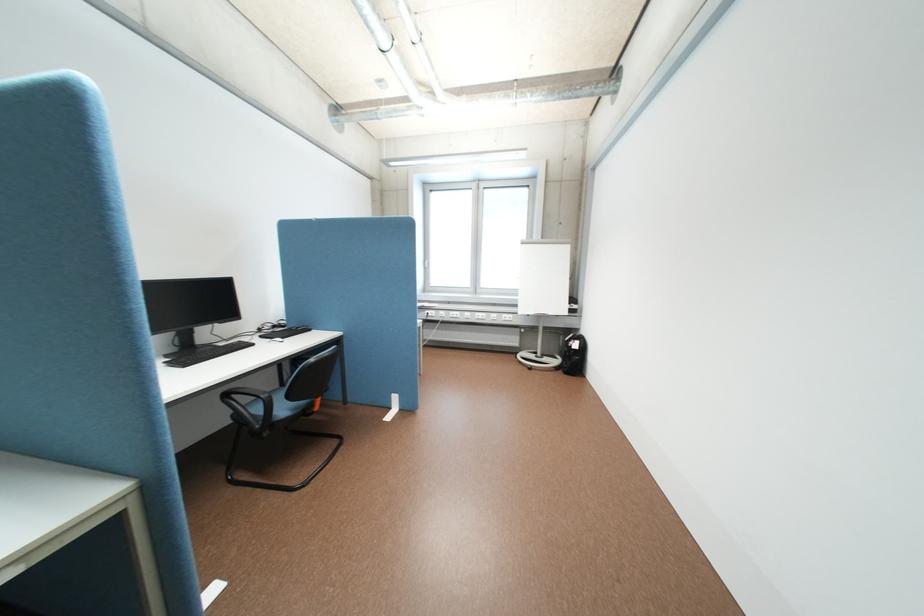
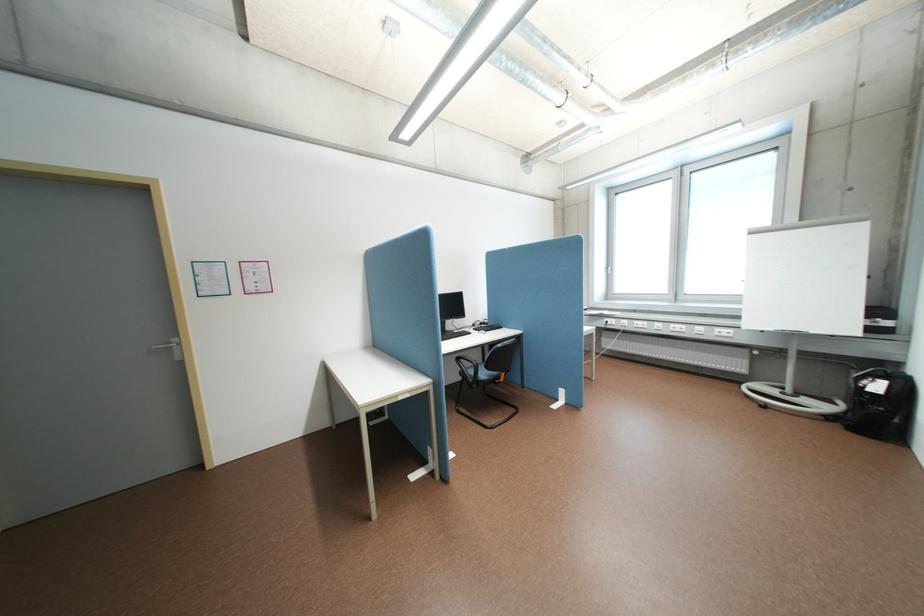
The point at (x=295, y=408) is marked in the first image. Where is the corresponding point in the second image?

(494, 374)